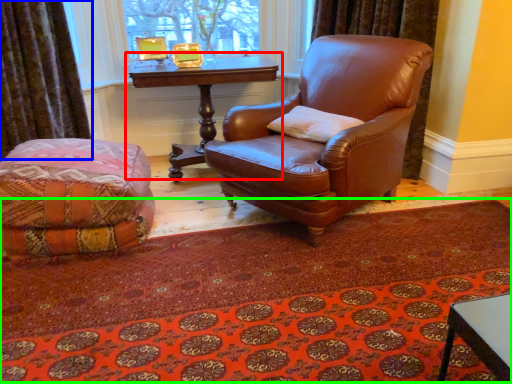
Question: Which is nearer to the table (highlighted by a red box)? curtain (highlighted by a blue box) or mat (highlighted by a green box).

Choices:
 (A) curtain
 (B) mat

Answer: (A)